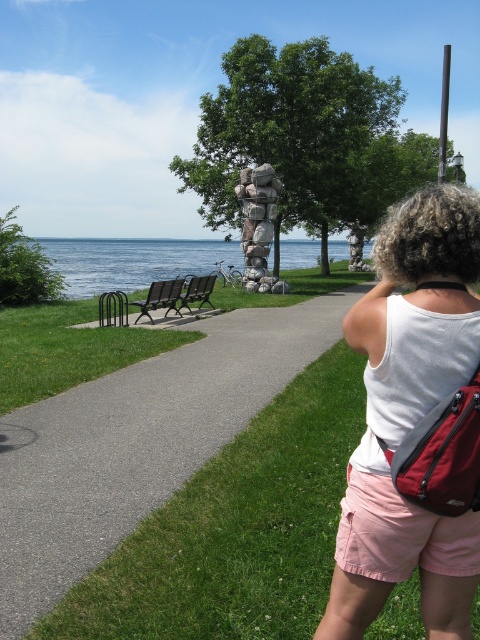
You are a photographer trying to capture a candid shot of the person in the pink cotton shorts at lower right without them noticing. The black plastic bench at left is blocking your view. Can you move to the side to get an unobstructed view?

The pink cotton shorts at lower right is in front of the black plastic bench at left, so moving to the side might allow you to see around the bench and capture the shot without obstruction.

You are standing on the paved pathway and want to take a photo of the blue water at center without the person in the frame. Which direction should you move to avoid the person wearing the white fabric tank top at upper right?

Move away from the white fabric tank top at upper right since it is closer to you than the blue water at center, so moving away from it will allow you to frame the blue water at center without the person blocking the view.